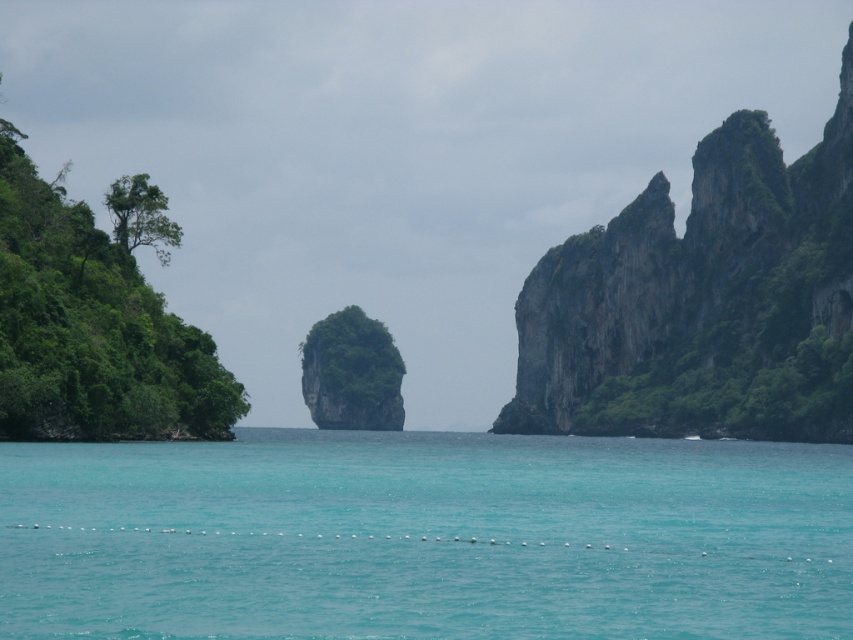
Question: Considering the relative positions of turquoise water at center and green mossy rock at right in the image provided, where is turquoise water at center located with respect to green mossy rock at right?

Choices:
 (A) left
 (B) right

Answer: (A)

Question: Is turquoise water at center to the right of green mossy rock at right from the viewer's perspective?

Choices:
 (A) yes
 (B) no

Answer: (B)

Question: Which point appears closest to the camera in this image?

Choices:
 (A) (608, 346)
 (B) (297, 454)

Answer: (B)

Question: Is turquoise water at center further to camera compared to green mossy rock at right?

Choices:
 (A) no
 (B) yes

Answer: (A)

Question: Which of the following is the closest to the observer?

Choices:
 (A) (730, 260)
 (B) (96, 547)

Answer: (B)